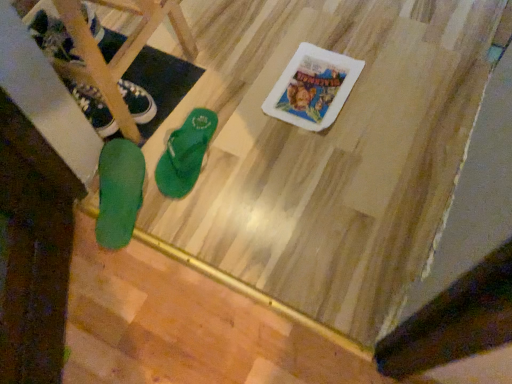
Locate an element on the screen. The image size is (512, 384). green rubber flip-flop at lower left, the 2th footwear positioned from the left is located at coordinates (119, 192).

The width and height of the screenshot is (512, 384). In order to click on green rubber flip-flop at center, marked as the first footwear in a right-to-left arrangement in this screenshot , I will do `click(185, 154)`.

Who is bigger, green rubber flip-flop at center, marked as the first footwear in a right-to-left arrangement, or green rubber flip-flop at lower left, the 2th footwear positioned from the left?

green rubber flip-flop at lower left, the 2th footwear positioned from the left, is bigger.

In terms of height, does green rubber flip-flop at center, marked as the first footwear in a right-to-left arrangement, look taller or shorter compared to green rubber flip-flop at lower left, the 2th footwear positioned from the left?

Clearly, green rubber flip-flop at center, marked as the first footwear in a right-to-left arrangement, is shorter compared to green rubber flip-flop at lower left, the 2th footwear positioned from the left.

At what (x,y) coordinates should I click in order to perform the action: click on the 1st footwear to the left of the green rubber flip-flop at center, the third footwear from the left, starting your count from the anchor. Please return your answer as a coordinate pair (x, y). This screenshot has width=512, height=384. Looking at the image, I should click on (119, 192).

Between green rubber flip-flop at center, the third footwear from the left, and green rubber flip-flop at lower left, the 2th footwear positioned from the left, which one is positioned behind?

green rubber flip-flop at center, the third footwear from the left, is further away from the camera.

Is green rubber flip-flop at lower left, the second footwear when ordered from right to left, wider than green rubber flip-flop at lower left, which appears as the first footwear when viewed from the left?

Yes, green rubber flip-flop at lower left, the second footwear when ordered from right to left, is wider than green rubber flip-flop at lower left, which appears as the first footwear when viewed from the left.

Choose the correct answer: Is green rubber flip-flop at lower left, the 2th footwear positioned from the left, inside green rubber flip-flop at lower left, the 3th footwear when ordered from right to left, or outside it?

green rubber flip-flop at lower left, the 2th footwear positioned from the left, is not inside green rubber flip-flop at lower left, the 3th footwear when ordered from right to left, it's outside.

Is point (115, 164) closer or farther from the camera than point (140, 93)?

Point (115, 164) is positioned closer to the camera compared to point (140, 93).

In the scene shown: Which of these two, green rubber flip-flop at lower left, the second footwear when ordered from right to left, or green rubber flip-flop at lower left, which appears as the first footwear when viewed from the left, stands taller?

Standing taller between the two is green rubber flip-flop at lower left, the second footwear when ordered from right to left.

Considering the relative sizes of green rubber flip-flop at lower left, the second footwear when ordered from right to left, and green rubber flip-flop at center, marked as the first footwear in a right-to-left arrangement, in the image provided, is green rubber flip-flop at lower left, the second footwear when ordered from right to left, thinner than green rubber flip-flop at center, marked as the first footwear in a right-to-left arrangement,?

No, green rubber flip-flop at lower left, the second footwear when ordered from right to left, is not thinner than green rubber flip-flop at center, marked as the first footwear in a right-to-left arrangement.

Is green rubber flip-flop at center, marked as the first footwear in a right-to-left arrangement, at the back of green rubber flip-flop at lower left, the second footwear when ordered from right to left?

That's not correct — green rubber flip-flop at lower left, the second footwear when ordered from right to left, is not looking away from green rubber flip-flop at center, marked as the first footwear in a right-to-left arrangement.

Would you consider green rubber flip-flop at lower left, the 2th footwear positioned from the left, to be distant from green rubber flip-flop at center, the third footwear from the left?

No, green rubber flip-flop at lower left, the 2th footwear positioned from the left, is in close proximity to green rubber flip-flop at center, the third footwear from the left.

Starting from the green rubber flip-flop at center, the third footwear from the left, which footwear is the 2nd one to the left? Please provide its 2D coordinates.

[(93, 108)]

Considering the sizes of objects green rubber flip-flop at lower left, which appears as the first footwear when viewed from the left, and green rubber flip-flop at center, the third footwear from the left, in the image provided, who is thinner, green rubber flip-flop at lower left, which appears as the first footwear when viewed from the left, or green rubber flip-flop at center, the third footwear from the left,?

Thinner between the two is green rubber flip-flop at lower left, which appears as the first footwear when viewed from the left.

What's the angular difference between green rubber flip-flop at lower left, the 3th footwear when ordered from right to left, and green rubber flip-flop at center, the third footwear from the left,'s facing directions?

They differ by 24.9 degrees in their facing directions.

From their relative heights in the image, would you say green rubber flip-flop at lower left, the 3th footwear when ordered from right to left, is taller or shorter than green rubber flip-flop at center, marked as the first footwear in a right-to-left arrangement?

→ green rubber flip-flop at lower left, the 3th footwear when ordered from right to left, is taller than green rubber flip-flop at center, marked as the first footwear in a right-to-left arrangement.

Consider the image. Is green rubber flip-flop at lower left, which appears as the first footwear when viewed from the left, looking in the opposite direction of green rubber flip-flop at lower left, the second footwear when ordered from right to left?

green rubber flip-flop at lower left, which appears as the first footwear when viewed from the left, does not have its back to green rubber flip-flop at lower left, the second footwear when ordered from right to left.

Does green rubber flip-flop at lower left, the 3th footwear when ordered from right to left, have a larger size compared to green rubber flip-flop at lower left, the 2th footwear positioned from the left?

Incorrect, green rubber flip-flop at lower left, the 3th footwear when ordered from right to left, is not larger than green rubber flip-flop at lower left, the 2th footwear positioned from the left.

Is point (75, 87) closer to viewer compared to point (115, 239)?

No, it is not.

How much distance is there between green rubber flip-flop at lower left, the 3th footwear when ordered from right to left, and green rubber flip-flop at lower left, the 2th footwear positioned from the left?

green rubber flip-flop at lower left, the 3th footwear when ordered from right to left, and green rubber flip-flop at lower left, the 2th footwear positioned from the left, are 6.53 inches apart from each other.

Identify the location of footwear that appears behind the green rubber flip-flop at center, the third footwear from the left. (93, 108).

Is green rubber flip-flop at center, the third footwear from the left, bigger or smaller than green rubber flip-flop at lower left, which appears as the first footwear when viewed from the left?

In the image, green rubber flip-flop at center, the third footwear from the left, appears to be larger than green rubber flip-flop at lower left, which appears as the first footwear when viewed from the left.

From a real-world perspective, who is located higher, green rubber flip-flop at center, marked as the first footwear in a right-to-left arrangement, or green rubber flip-flop at lower left, which appears as the first footwear when viewed from the left?

green rubber flip-flop at lower left, which appears as the first footwear when viewed from the left, from a real-world perspective.

Starting from the green rubber flip-flop at lower left, the second footwear when ordered from right to left, which footwear is the 1st one behind? Please provide its 2D coordinates.

[(185, 154)]

Where is `footwear on the left of the green rubber flip-flop at lower left, the second footwear when ordered from right to left`? The width and height of the screenshot is (512, 384). footwear on the left of the green rubber flip-flop at lower left, the second footwear when ordered from right to left is located at coordinates (93, 108).

Looking at the image, which one is located further to green rubber flip-flop at lower left, the 2th footwear positioned from the left, green rubber flip-flop at lower left, which appears as the first footwear when viewed from the left, or green rubber flip-flop at center, marked as the first footwear in a right-to-left arrangement?

Among the two, green rubber flip-flop at lower left, which appears as the first footwear when viewed from the left, is located further to green rubber flip-flop at lower left, the 2th footwear positioned from the left.

Considering their positions, is green rubber flip-flop at center, the third footwear from the left, positioned further to green rubber flip-flop at lower left, the second footwear when ordered from right to left, than green rubber flip-flop at lower left, the 3th footwear when ordered from right to left?

Based on the image, green rubber flip-flop at lower left, the 3th footwear when ordered from right to left, appears to be further to green rubber flip-flop at lower left, the second footwear when ordered from right to left.

Considering their positions, is green rubber flip-flop at lower left, the 3th footwear when ordered from right to left, positioned further to green rubber flip-flop at center, marked as the first footwear in a right-to-left arrangement, than green rubber flip-flop at lower left, the second footwear when ordered from right to left?

The object further to green rubber flip-flop at center, marked as the first footwear in a right-to-left arrangement, is green rubber flip-flop at lower left, the 3th footwear when ordered from right to left.

Based on their spatial positions, is green rubber flip-flop at center, the third footwear from the left, or green rubber flip-flop at lower left, the second footwear when ordered from right to left, further from green rubber flip-flop at lower left, which appears as the first footwear when viewed from the left?

Based on the image, green rubber flip-flop at center, the third footwear from the left, appears to be further to green rubber flip-flop at lower left, which appears as the first footwear when viewed from the left.

Looking at the image, which one is located further to green rubber flip-flop at lower left, which appears as the first footwear when viewed from the left, green rubber flip-flop at lower left, the second footwear when ordered from right to left, or green rubber flip-flop at center, the third footwear from the left?

green rubber flip-flop at center, the third footwear from the left, lies further to green rubber flip-flop at lower left, which appears as the first footwear when viewed from the left, than the other object.

Consider the image. When comparing their distances from green rubber flip-flop at center, marked as the first footwear in a right-to-left arrangement, does green rubber flip-flop at lower left, the 2th footwear positioned from the left, or green rubber flip-flop at lower left, the 3th footwear when ordered from right to left, seem closer?

green rubber flip-flop at lower left, the 2th footwear positioned from the left, lies closer to green rubber flip-flop at center, marked as the first footwear in a right-to-left arrangement, than the other object.

The height and width of the screenshot is (384, 512). I want to click on footwear between green rubber flip-flop at lower left, the 3th footwear when ordered from right to left, and green rubber flip-flop at lower left, the 2th footwear positioned from the left, vertically, so click(x=185, y=154).